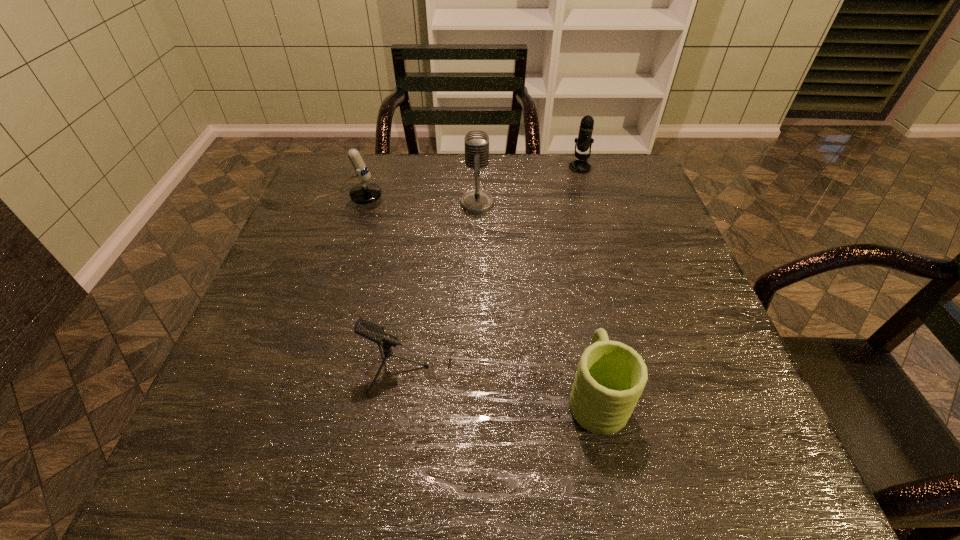
Where is `free region at the left edge of the desktop`? The image size is (960, 540). free region at the left edge of the desktop is located at coordinates (307, 353).

Identify the location of blank space at the right edge of the desktop. The height and width of the screenshot is (540, 960). (675, 427).

This screenshot has height=540, width=960. In the image, there is a desktop. In order to click on blank space at the far left corner in this screenshot , I will do `click(323, 168)`.

The image size is (960, 540). What are the coordinates of `vacant area at the near left corner` in the screenshot? It's located at (265, 441).

The image size is (960, 540). In order to click on vacant space at the far right corner in this screenshot , I will do `click(629, 194)`.

The image size is (960, 540). Identify the location of free space between the mug and the shortest microphone. (510, 382).

Identify the location of empty space that is in between the farthest object and the shortest microphone. This screenshot has height=540, width=960. (502, 268).

Where is `free spot between the mug and the shortest microphone`? This screenshot has height=540, width=960. free spot between the mug and the shortest microphone is located at coordinates (510, 382).

This screenshot has height=540, width=960. What are the coordinates of `free space between the second object from right to left and the shortest microphone` in the screenshot? It's located at (510, 382).

Where is `free spot between the leftmost object and the second object from right to left`? free spot between the leftmost object and the second object from right to left is located at coordinates (470, 298).